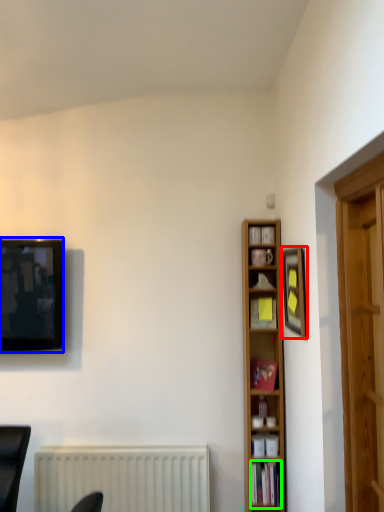
Question: Estimate the real-world distances between objects in this image. Which object is farther from picture frame (highlighted by a red box), television (highlighted by a blue box) or book (highlighted by a green box)?

Choices:
 (A) television
 (B) book

Answer: (A)